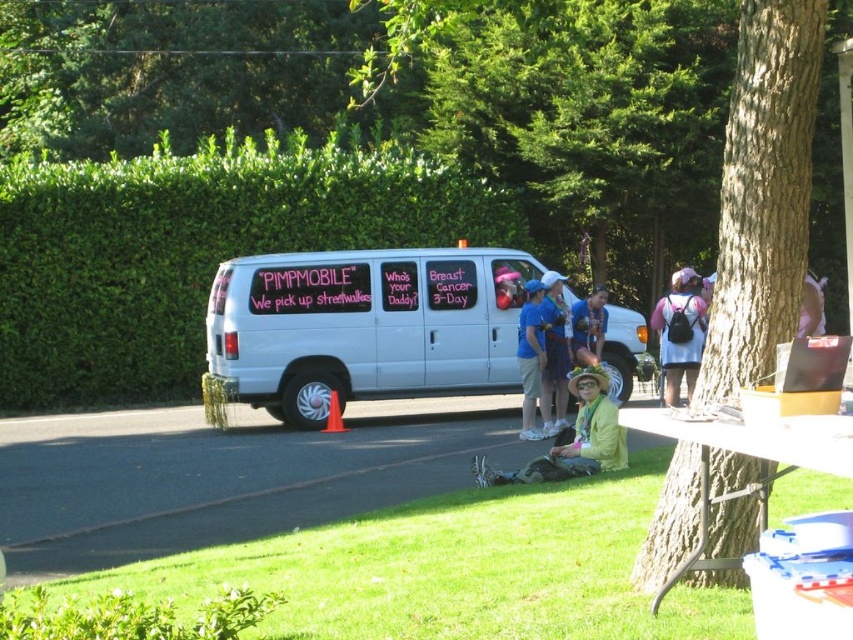
Question: Does brown rough bark tree at center appear on the right side of blue denim shorts at center?

Choices:
 (A) no
 (B) yes

Answer: (A)

Question: Which point is farther to the camera?

Choices:
 (A) blue denim shorts at center
 (B) green leafy hedge at upper left

Answer: (B)

Question: Which point is closer to the camera taking this photo?

Choices:
 (A) (675, 500)
 (B) (801, 330)
 (C) (566, 452)
 (D) (621, 362)

Answer: (A)

Question: Which object is positioned farthest from the pink backpack at center?

Choices:
 (A) white matte van at center
 (B) yellow fabric jacket at lower center

Answer: (A)

Question: Can you confirm if pink backpack at center is wider than blue fabric shirt at center?

Choices:
 (A) yes
 (B) no

Answer: (B)

Question: In this image, where is white matte van at center located relative to pink backpack at center?

Choices:
 (A) below
 (B) above

Answer: (B)